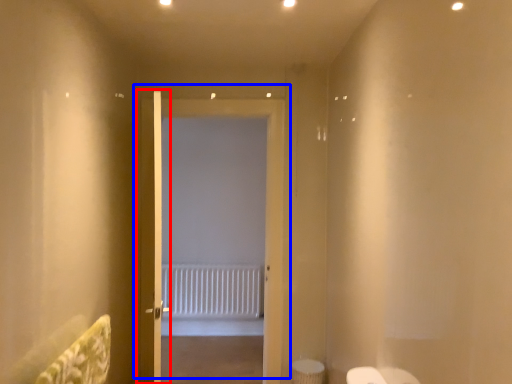
Question: Which of the following is the closest to the observer, door (highlighted by a red box) or door (highlighted by a blue box)?

Choices:
 (A) door
 (B) door

Answer: (A)